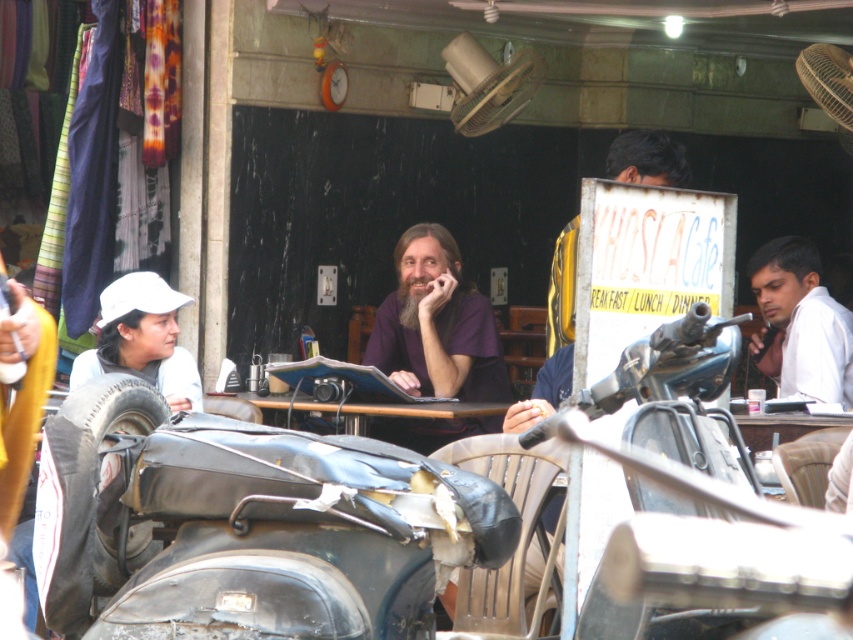
Question: Considering the real-world distances, which object is closest to the wooden table at center?

Choices:
 (A) dark purple shirt at center
 (B) black leather motorcycle at lower left

Answer: (A)

Question: Is black leather motorcycle at lower left thinner than wooden table at center?

Choices:
 (A) yes
 (B) no

Answer: (B)

Question: Can you confirm if black leather motorcycle at lower left is thinner than wooden table at center?

Choices:
 (A) no
 (B) yes

Answer: (A)

Question: Can you confirm if yellow fabric shirt at center is bigger than wooden table at center?

Choices:
 (A) no
 (B) yes

Answer: (A)

Question: Which point is farther to the camera?

Choices:
 (A) (798, 314)
 (B) (643, 140)
 (C) (422, 433)

Answer: (C)

Question: Among these points, which one is nearest to the camera?

Choices:
 (A) pyautogui.click(x=299, y=394)
 (B) pyautogui.click(x=817, y=388)

Answer: (B)